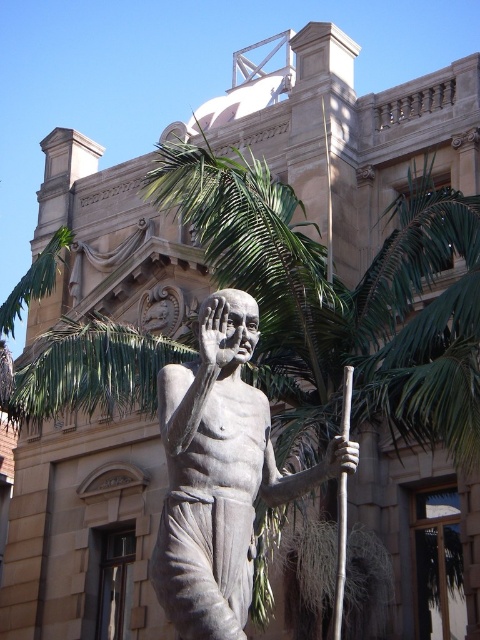
Question: Is bronze statue at center above brown wood pole at center?

Choices:
 (A) no
 (B) yes

Answer: (B)

Question: Which of the following is the closest to the observer?

Choices:
 (A) brown wood pole at center
 (B) bronze statue at center

Answer: (B)

Question: Can you confirm if bronze statue at center is bigger than brown wood pole at center?

Choices:
 (A) no
 (B) yes

Answer: (B)

Question: Can you confirm if bronze statue at center is bigger than brown wood pole at center?

Choices:
 (A) no
 (B) yes

Answer: (B)

Question: Which object is farther from the camera taking this photo?

Choices:
 (A) bronze statue at center
 (B) brown wood pole at center

Answer: (B)